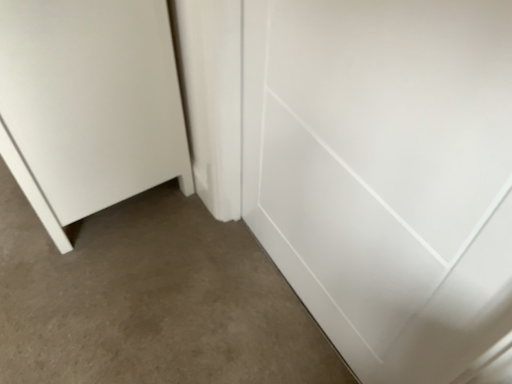
Describe the element at coordinates (89, 105) in the screenshot. I see `white matte door at lower left, which is counted as the 1th door, starting from the left` at that location.

Find the location of `white matte door at lower left, which is the second door from right to left`. white matte door at lower left, which is the second door from right to left is located at coordinates (89, 105).

Locate an element on the screen. This screenshot has width=512, height=384. white glossy door at center, acting as the 2th door starting from the left is located at coordinates (386, 174).

What do you see at coordinates (386, 174) in the screenshot? I see `white glossy door at center, which is the 1th door in right-to-left order` at bounding box center [386, 174].

The height and width of the screenshot is (384, 512). I want to click on white matte door at lower left, which is counted as the 1th door, starting from the left, so click(89, 105).

Visually, is white matte door at lower left, which is counted as the 1th door, starting from the left, positioned to the left or to the right of white glossy door at center, acting as the 2th door starting from the left?

white matte door at lower left, which is counted as the 1th door, starting from the left, is positioned on white glossy door at center, acting as the 2th door starting from the left,'s left side.

Is white matte door at lower left, which is counted as the 1th door, starting from the left, in front of or behind white glossy door at center, which is the 1th door in right-to-left order, in the image?

Visually, white matte door at lower left, which is counted as the 1th door, starting from the left, is located behind white glossy door at center, which is the 1th door in right-to-left order.

Is point (136, 149) closer to camera compared to point (344, 182)?

No, (136, 149) is behind (344, 182).

From the image's perspective, which one is positioned higher, white matte door at lower left, which is the second door from right to left, or white glossy door at center, acting as the 2th door starting from the left?

white matte door at lower left, which is the second door from right to left, appears higher in the image.

From a real-world perspective, is white matte door at lower left, which is counted as the 1th door, starting from the left, physically below white glossy door at center, acting as the 2th door starting from the left?

Yes, from a real-world perspective, white matte door at lower left, which is counted as the 1th door, starting from the left, is beneath white glossy door at center, acting as the 2th door starting from the left.

Can you confirm if white matte door at lower left, which is counted as the 1th door, starting from the left, is wider than white glossy door at center, which is the 1th door in right-to-left order?

Yes, white matte door at lower left, which is counted as the 1th door, starting from the left, is wider than white glossy door at center, which is the 1th door in right-to-left order.

Which of these two, white matte door at lower left, which is counted as the 1th door, starting from the left, or white glossy door at center, which is the 1th door in right-to-left order, stands taller?

Standing taller between the two is white glossy door at center, which is the 1th door in right-to-left order.

Does white matte door at lower left, which is the second door from right to left, have a larger size compared to white glossy door at center, acting as the 2th door starting from the left?

Yes.

Is white matte door at lower left, which is the second door from right to left, inside the boundaries of white glossy door at center, acting as the 2th door starting from the left, or outside?

white matte door at lower left, which is the second door from right to left, exists outside the volume of white glossy door at center, acting as the 2th door starting from the left.

Would you consider white matte door at lower left, which is counted as the 1th door, starting from the left, to be distant from white glossy door at center, acting as the 2th door starting from the left?

No, white matte door at lower left, which is counted as the 1th door, starting from the left, is not far from white glossy door at center, acting as the 2th door starting from the left.

Is white matte door at lower left, which is counted as the 1th door, starting from the left, aimed at white glossy door at center, acting as the 2th door starting from the left?

No.

How different are the orientations of white matte door at lower left, which is counted as the 1th door, starting from the left, and white glossy door at center, which is the 1th door in right-to-left order, in degrees?

0.859 degrees separate the facing orientations of white matte door at lower left, which is counted as the 1th door, starting from the left, and white glossy door at center, which is the 1th door in right-to-left order.

Identify the location of door that is on the left side of white glossy door at center, acting as the 2th door starting from the left. (89, 105).

Is white glossy door at center, acting as the 2th door starting from the left, to the left of white matte door at lower left, which is counted as the 1th door, starting from the left, from the viewer's perspective?

In fact, white glossy door at center, acting as the 2th door starting from the left, is to the right of white matte door at lower left, which is counted as the 1th door, starting from the left.

Which is behind, white glossy door at center, which is the 1th door in right-to-left order, or white matte door at lower left, which is the second door from right to left?

white matte door at lower left, which is the second door from right to left, is further away from the camera.

Is point (484, 108) closer to viewer compared to point (148, 13)?

Yes, point (484, 108) is closer to viewer.

From the image's perspective, which one is positioned higher, white glossy door at center, acting as the 2th door starting from the left, or white matte door at lower left, which is counted as the 1th door, starting from the left?

white matte door at lower left, which is counted as the 1th door, starting from the left.

From a real-world perspective, is white glossy door at center, which is the 1th door in right-to-left order, positioned over white matte door at lower left, which is counted as the 1th door, starting from the left, based on gravity?

Indeed, from a real-world perspective, white glossy door at center, which is the 1th door in right-to-left order, stands above white matte door at lower left, which is counted as the 1th door, starting from the left.

Considering the sizes of objects white glossy door at center, acting as the 2th door starting from the left, and white matte door at lower left, which is counted as the 1th door, starting from the left, in the image provided, who is wider, white glossy door at center, acting as the 2th door starting from the left, or white matte door at lower left, which is counted as the 1th door, starting from the left,?

With larger width is white matte door at lower left, which is counted as the 1th door, starting from the left.

Who is shorter, white glossy door at center, acting as the 2th door starting from the left, or white matte door at lower left, which is counted as the 1th door, starting from the left?

Standing shorter between the two is white matte door at lower left, which is counted as the 1th door, starting from the left.

Based on their sizes in the image, would you say white glossy door at center, which is the 1th door in right-to-left order, is bigger or smaller than white matte door at lower left, which is counted as the 1th door, starting from the left?

Considering their sizes, white glossy door at center, which is the 1th door in right-to-left order, takes up less space than white matte door at lower left, which is counted as the 1th door, starting from the left.

Based on the photo, is white glossy door at center, acting as the 2th door starting from the left, spatially inside white matte door at lower left, which is counted as the 1th door, starting from the left, or outside of it?

white glossy door at center, acting as the 2th door starting from the left, is not enclosed by white matte door at lower left, which is counted as the 1th door, starting from the left.

Is white glossy door at center, which is the 1th door in right-to-left order, next to white matte door at lower left, which is counted as the 1th door, starting from the left, and touching it?

white glossy door at center, which is the 1th door in right-to-left order, and white matte door at lower left, which is counted as the 1th door, starting from the left, are not in contact.

Is white glossy door at center, which is the 1th door in right-to-left order, positioned with its back to white matte door at lower left, which is counted as the 1th door, starting from the left?

No, white matte door at lower left, which is counted as the 1th door, starting from the left, is not at the back of white glossy door at center, which is the 1th door in right-to-left order.

How different are the orientations of white glossy door at center, which is the 1th door in right-to-left order, and white matte door at lower left, which is counted as the 1th door, starting from the left, in degrees?

The facing directions of white glossy door at center, which is the 1th door in right-to-left order, and white matte door at lower left, which is counted as the 1th door, starting from the left, are 0.859 degrees apart.

From the picture: How distant is white glossy door at center, acting as the 2th door starting from the left, from white matte door at lower left, which is counted as the 1th door, starting from the left?

They are 20.43 inches apart.

At what (x,y) coordinates should I click in order to perform the action: click on door above the white glossy door at center, acting as the 2th door starting from the left (from the image's perspective). Please return your answer as a coordinate pair (x, y). Looking at the image, I should click on (89, 105).

I want to click on door below the white matte door at lower left, which is the second door from right to left (from the image's perspective), so pyautogui.click(x=386, y=174).

In the image, there is a white glossy door at center, which is the 1th door in right-to-left order. Where is `door below it (from a real-world perspective)`? This screenshot has width=512, height=384. door below it (from a real-world perspective) is located at coordinates (89, 105).